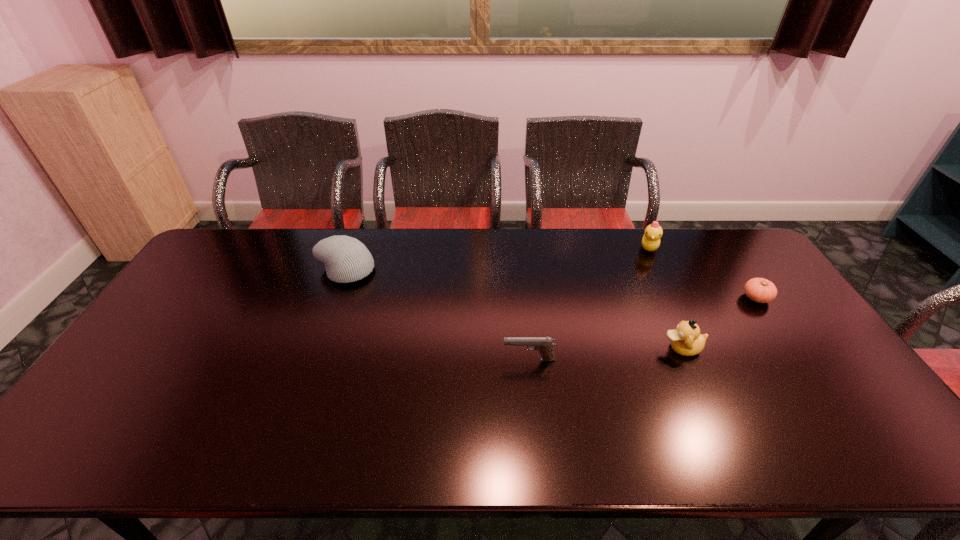
Locate an element on the screen. The width and height of the screenshot is (960, 540). beanie is located at coordinates (346, 259).

Image resolution: width=960 pixels, height=540 pixels. Find the location of `the farther duckling`. the farther duckling is located at coordinates (651, 239).

Identify the location of the nearer duckling. (686, 340).

What are the coordinates of `pistol` in the screenshot? It's located at (542, 344).

Find the location of a particular element. the second shortest object is located at coordinates (542, 344).

Find the location of a particular element. the shortest object is located at coordinates (760, 290).

You are a GUI agent. You are given a task and a screenshot of the screen. Output one action in this format:
    pyautogui.click(x=<x>, y=<y>)
    Task: Click on the rightmost object
    
    Given the screenshot: What is the action you would take?
    pyautogui.click(x=760, y=290)

This screenshot has height=540, width=960. In order to click on vacant space located 0.140m on the right of the beanie in this screenshot , I will do `click(417, 271)`.

Locate an element on the screen. Image resolution: width=960 pixels, height=540 pixels. vacant position located on the front-facing side of the farther duckling is located at coordinates (690, 336).

Where is `free spot located 0.240m on the face of the nearer duckling`? free spot located 0.240m on the face of the nearer duckling is located at coordinates (575, 348).